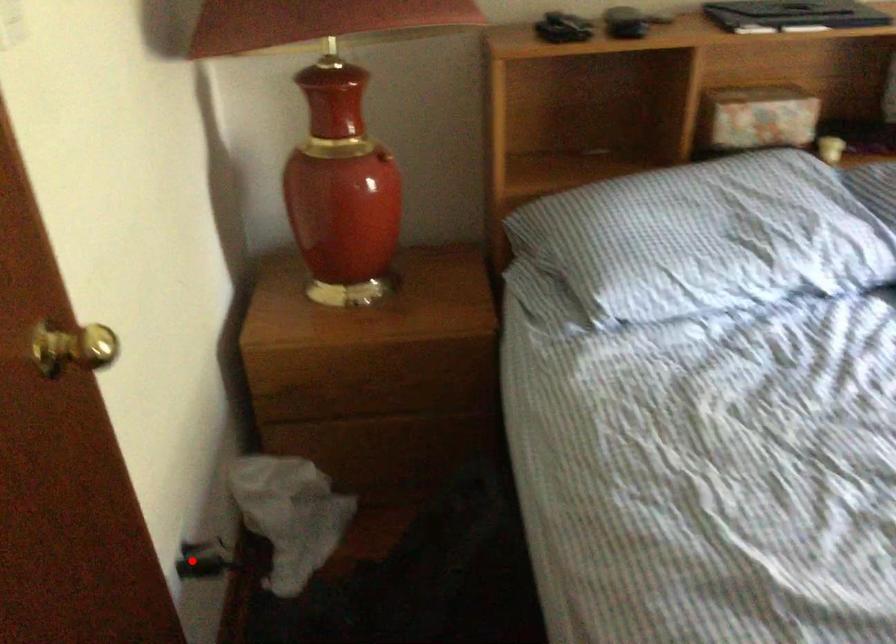
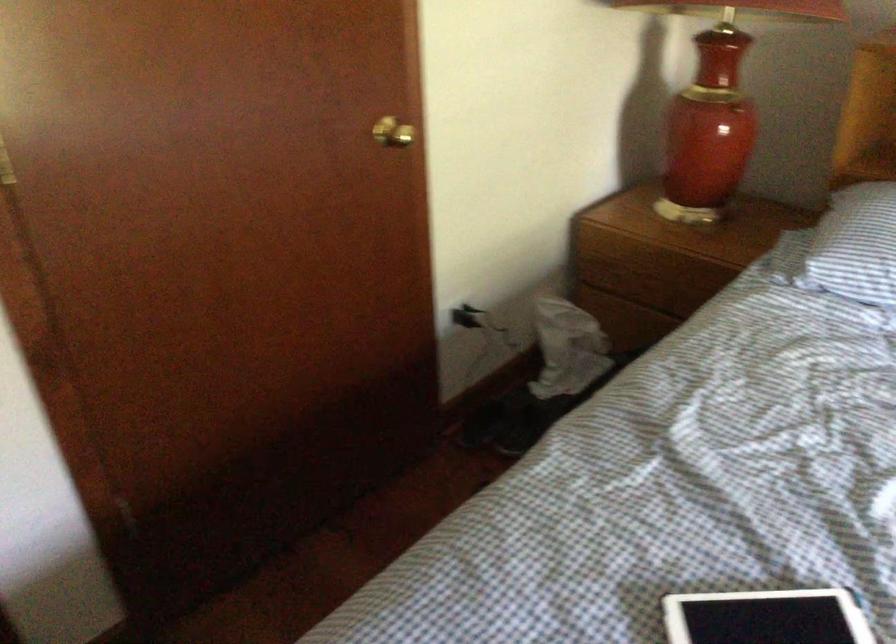
Where in the second image is the point corresponding to the highlighted location from the first image?

(470, 317)